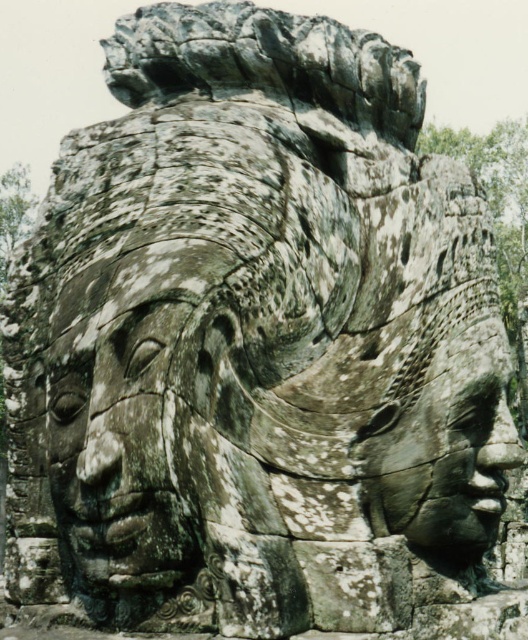
Is the position of gray stone face at center less distant than that of rough stone face at center?

Yes, gray stone face at center is closer to the viewer.

Does gray stone face at center appear on the right side of rough stone face at center?

No, gray stone face at center is not to the right of rough stone face at center.

Is point (86, 476) in front of point (438, 545)?

Yes.

The width and height of the screenshot is (528, 640). Find the location of `gray stone face at center`. gray stone face at center is located at coordinates (124, 413).